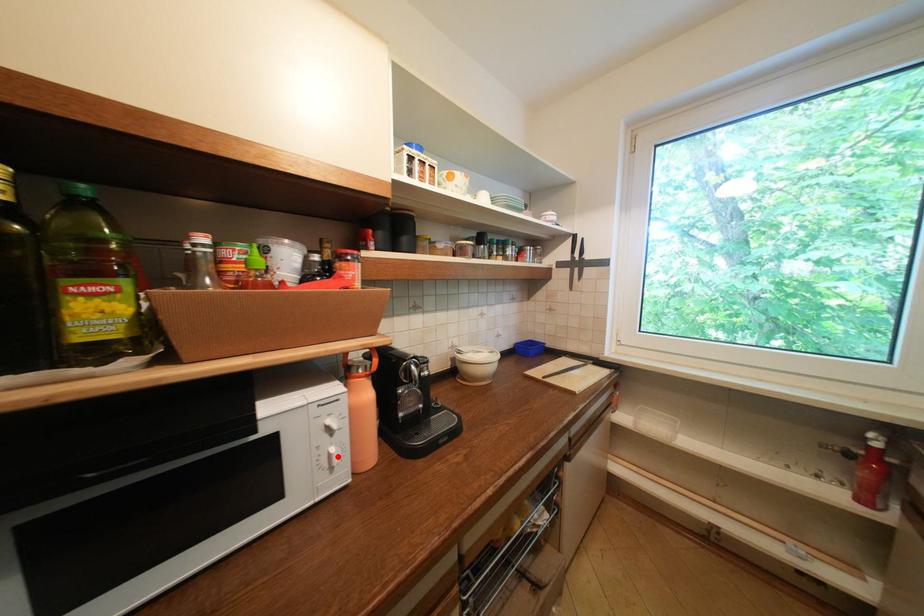
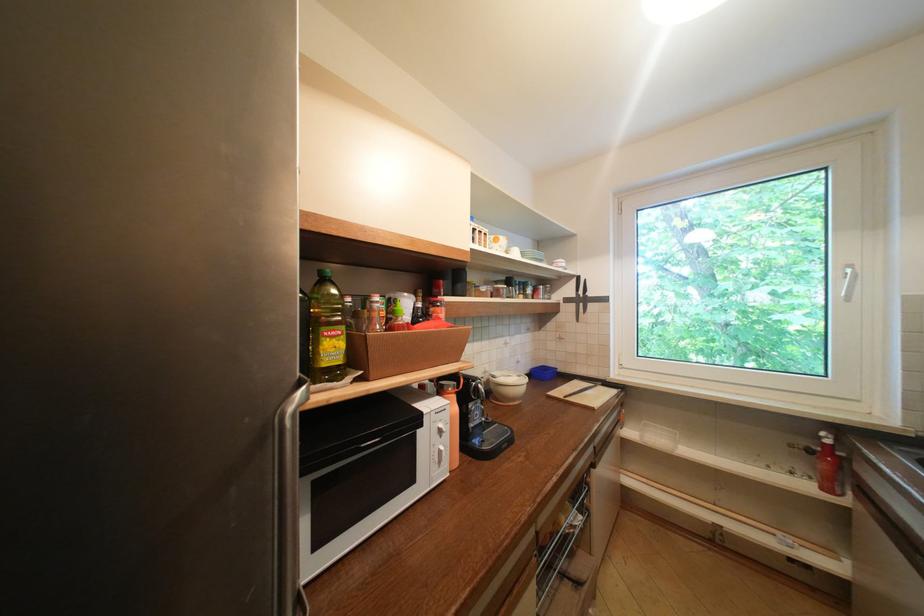
Where in the second image is the point corresponding to the highlighted location from the first image?

(448, 454)